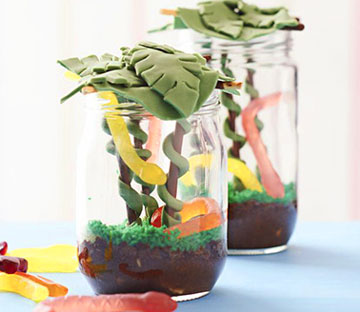
Locate an element on the screen. This screenshot has width=360, height=312. blue table top is located at coordinates (268, 284).